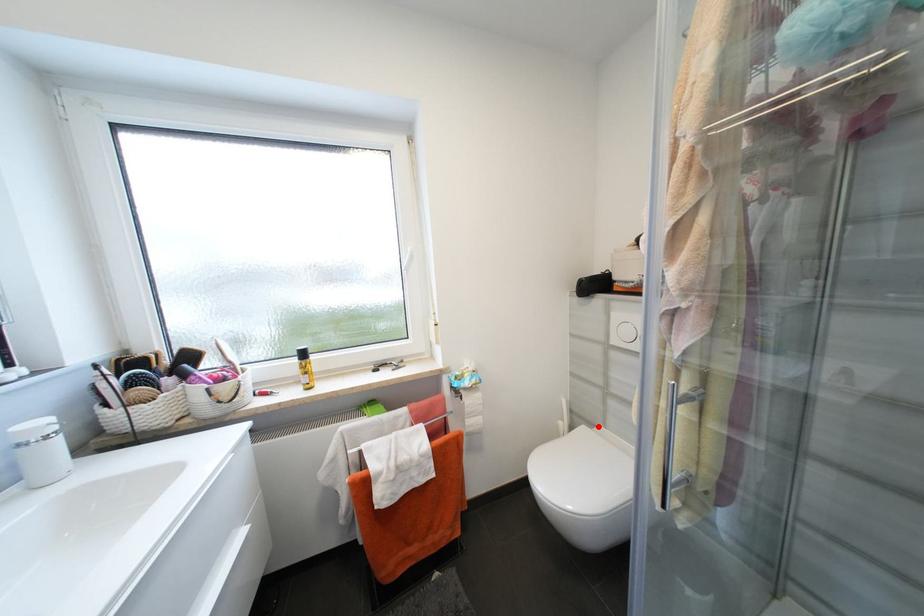
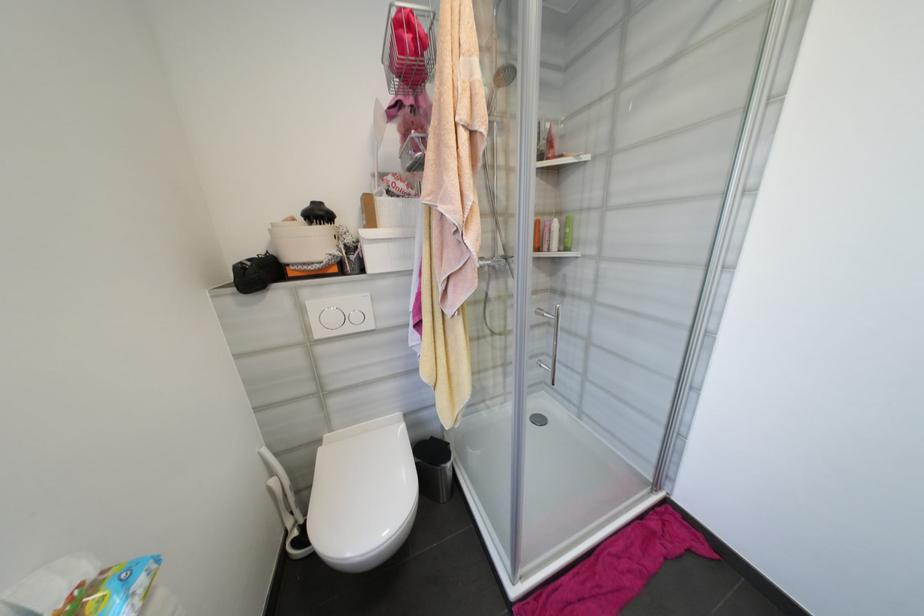
The point at the highlighted location is marked in the first image. Where is the corresponding point in the second image?

(325, 443)